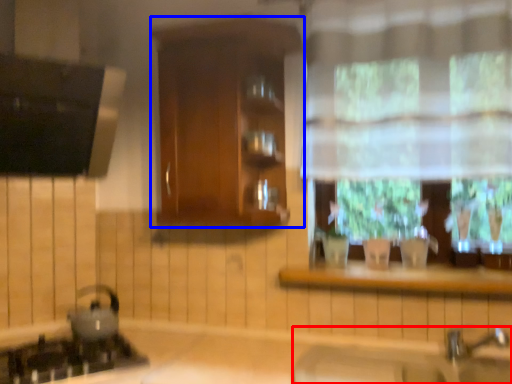
Question: Which of the following is the farthest to the observer, sink (highlighted by a red box) or cabinetry (highlighted by a blue box)?

Choices:
 (A) sink
 (B) cabinetry

Answer: (B)